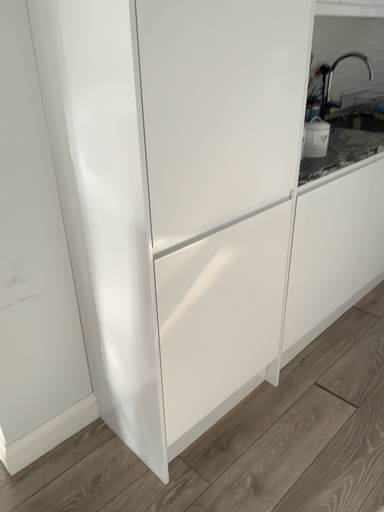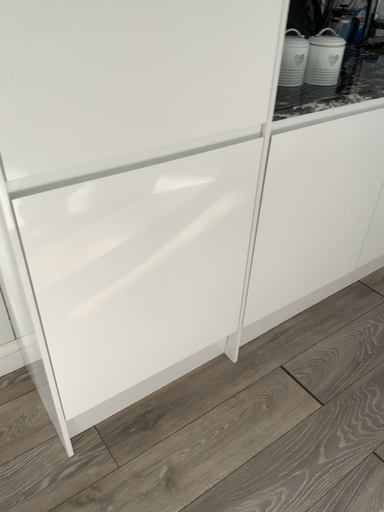
Question: Which way did the camera rotate in the video?

Choices:
 (A) rotated upward
 (B) rotated downward

Answer: (B)